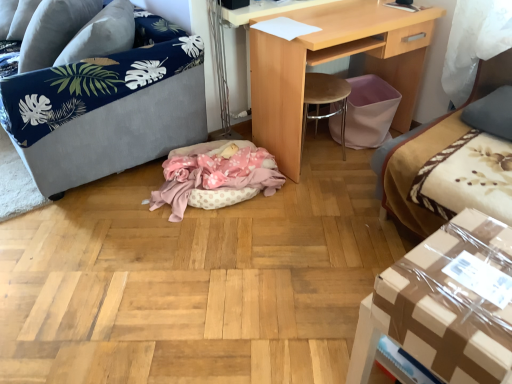
Question: From their relative heights in the image, would you say velvet grey sofa at left is taller or shorter than gray fabric pillow at upper right, which is the second pillow from left to right?

Choices:
 (A) tall
 (B) short

Answer: (A)

Question: Would you say velvet grey sofa at left is inside or outside gray fabric pillow at upper right, marked as the second pillow in a top-to-bottom arrangement?

Choices:
 (A) inside
 (B) outside

Answer: (B)

Question: Which object is positioned closest to the velvet grey sofa at left?

Choices:
 (A) velvet beige couch at right
 (B) gray fabric pillow at upper right, marked as the 1th pillow in a right-to-left arrangement
 (C) brown cardboard box at lower right
 (D) gray fabric pillow at upper left, the second pillow from the bottom
 (E) pink polka dot fabric cat bed at center

Answer: (D)

Question: Estimate the real-world distances between objects in this image. Which object is closer to the pink polka dot fabric cat bed at center?

Choices:
 (A) velvet grey sofa at left
 (B) light wood desk at center
 (C) gray fabric pillow at upper right, which is the second pillow from left to right
 (D) gray fabric pillow at upper left, the 1th pillow in the top-to-bottom sequence
 (E) brown cardboard box at lower right

Answer: (A)